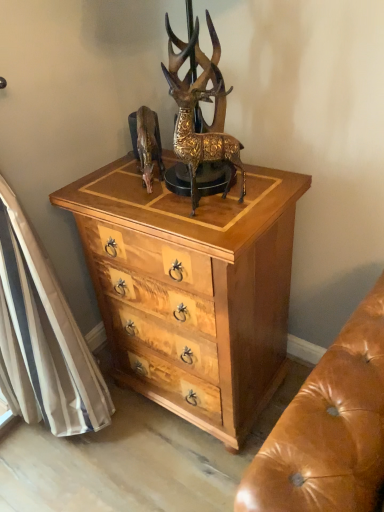
Identify the location of vacant area that lies in front of shiny brown deer at center. This screenshot has width=384, height=512. (151, 204).